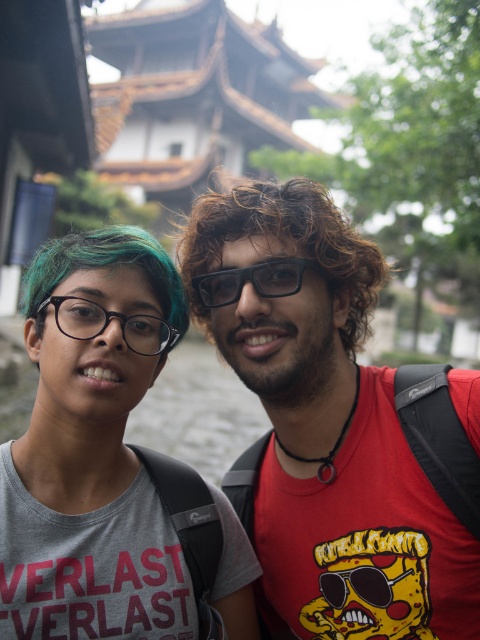
Does curly brown hair at center have a lesser width compared to matte black glasses at left?

No.

Which is behind, point (254, 234) or point (75, 326)?

Point (254, 234)

Describe the element at coordinates (283, 241) in the screenshot. The image size is (480, 640). I see `curly brown hair at center` at that location.

Where is `curly brown hair at center`? This screenshot has height=640, width=480. curly brown hair at center is located at coordinates (283, 241).

Which is behind, point (262, 204) or point (149, 273)?

The point (262, 204) is more distant.

Can you confirm if curly brown hair at center is positioned to the right of teal glossy hair at center?

Yes, curly brown hair at center is to the right of teal glossy hair at center.

Where is `curly brown hair at center`? The width and height of the screenshot is (480, 640). curly brown hair at center is located at coordinates (283, 241).

The image size is (480, 640). I want to click on curly brown hair at center, so click(x=283, y=241).

Does matte gray t-shirt at center appear under teal glossy hair at center?

Correct, matte gray t-shirt at center is located below teal glossy hair at center.

Does matte gray t-shirt at center have a larger size compared to teal glossy hair at center?

Actually, matte gray t-shirt at center might be smaller than teal glossy hair at center.

Which is in front, point (57, 428) or point (84, 266)?

Point (84, 266) is in front.

At what (x,y) coordinates should I click in order to perform the action: click on matte gray t-shirt at center. Please return your answer as a coordinate pair (x, y). The height and width of the screenshot is (640, 480). Looking at the image, I should click on (93, 451).